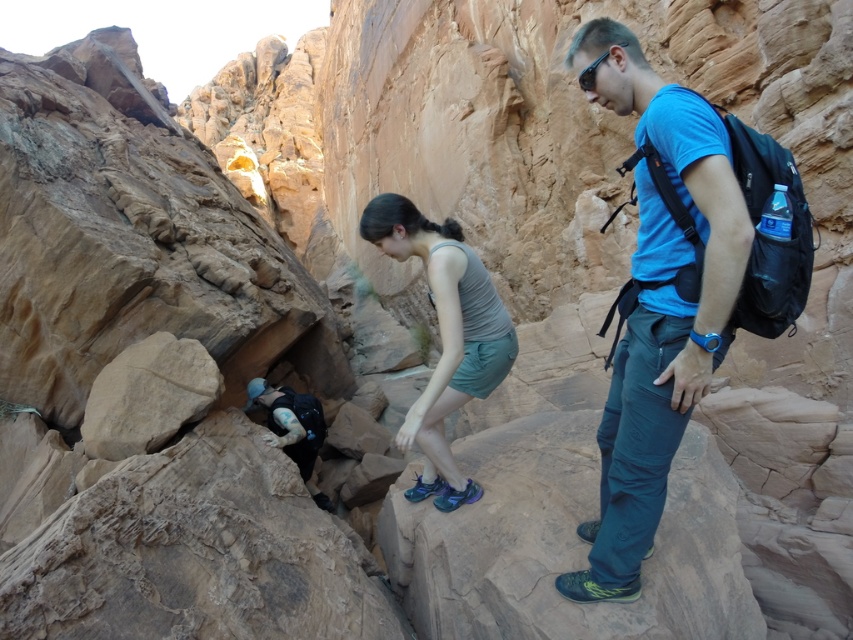
You are a hiker trying to identify the largest object among the blue fabric shirt at upper right and the black plastic sunglasses at upper right in the canyon scene. Which one is larger?

The blue fabric shirt at upper right is bigger than the black plastic sunglasses at upper right.

You are a hiker trying to cross the canyon. You notice a blue fabric shirt at center and a black plastic sunglasses at upper right. Which object is nearer to you as you look towards the canyon wall?

The blue fabric shirt at center is closer to the viewer than the black plastic sunglasses at upper right.

You are a hiker trying to identify clothing items in the scene. Which clothing item is wider between the blue fabric shirt at upper right and the black plastic sunglasses at upper right?

The blue fabric shirt at upper right is wider than the black plastic sunglasses at upper right.